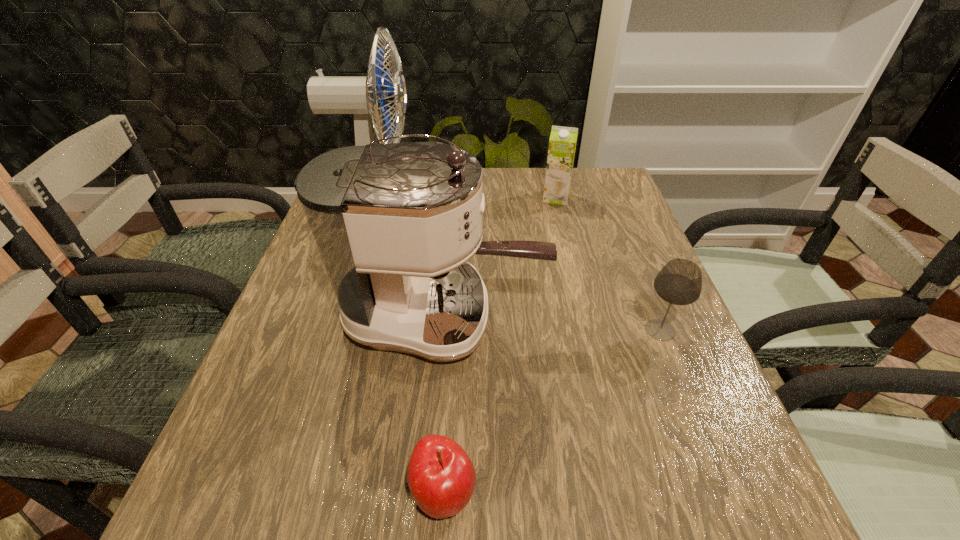
I want to click on free space between the second object from right to left and the fourth shortest object, so click(500, 258).

In order to click on free spot between the apple and the second tallest object in this screenshot , I will do `click(444, 405)`.

Where is `the fourth closest object to the apple`? the fourth closest object to the apple is located at coordinates (562, 144).

Choose which object is the third nearest neighbor to the coffee maker. Please provide its 2D coordinates. Your answer should be formatted as a tuple, i.e. [(x, y)], where the tuple contains the x and y coordinates of a point satisfying the conditions above.

[(364, 96)]

You are a GUI agent. You are given a task and a screenshot of the screen. Output one action in this format:
    pyautogui.click(x=<x>, y=<y>)
    Task: Click on the vacant region that satisfies the following two spatial constraints: 1. on the front-facing side of the second shortest object; 2. on the right side of the second tallest object
    This screenshot has width=960, height=540.
    Given the screenshot: What is the action you would take?
    pyautogui.click(x=443, y=330)

Identify the location of free space that satisfies the following two spatial constraints: 1. on the front-facing side of the fan; 2. on the left side of the fourth object from left to right. (382, 198).

Locate an element on the screen. This screenshot has height=540, width=960. free space that satisfies the following two spatial constraints: 1. on the front-facing side of the fan; 2. on the right side of the wineglass is located at coordinates (342, 330).

Find the location of a particular element. vacant area in the image that satisfies the following two spatial constraints: 1. on the front-facing side of the coffee maker; 2. on the right side of the apple is located at coordinates (429, 493).

I want to click on free space that satisfies the following two spatial constraints: 1. on the front-facing side of the fourth shortest object; 2. on the back side of the rightmost object, so click(x=443, y=330).

At what (x,y) coordinates should I click in order to perform the action: click on blank space that satisfies the following two spatial constraints: 1. on the front-facing side of the coffee maker; 2. on the left side of the rightmost object. Please return your answer as a coordinate pair (x, y). Image resolution: width=960 pixels, height=540 pixels. Looking at the image, I should click on (443, 330).